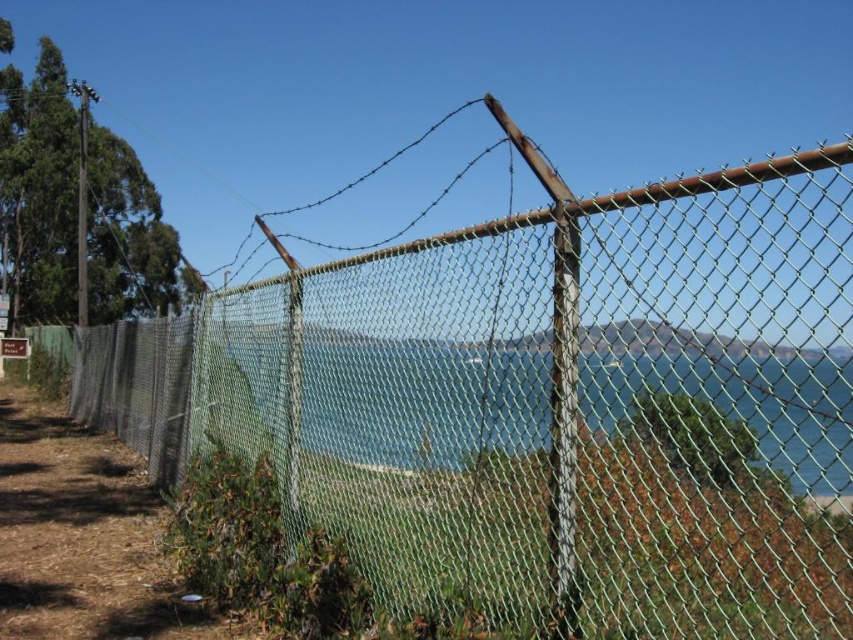
You are a painter who wants to paint the green mesh fence at center and the green mesh fence at lower left. Which fence should you focus on first if you want to paint the wider one?

The green mesh fence at center is wider than the green mesh fence at lower left, so you should focus on painting the green mesh fence at center first.

You are an observer standing in front of the green mesh fence at center and the green mesh fence at lower left. Which fence section is bigger in size?

The green mesh fence at center is larger in size compared to the green mesh fence at lower left.